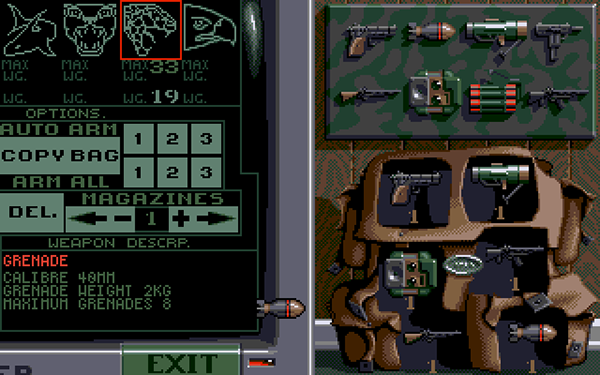
Locate an element on the screen. green and brown squiggly wall is located at coordinates (341, 171).